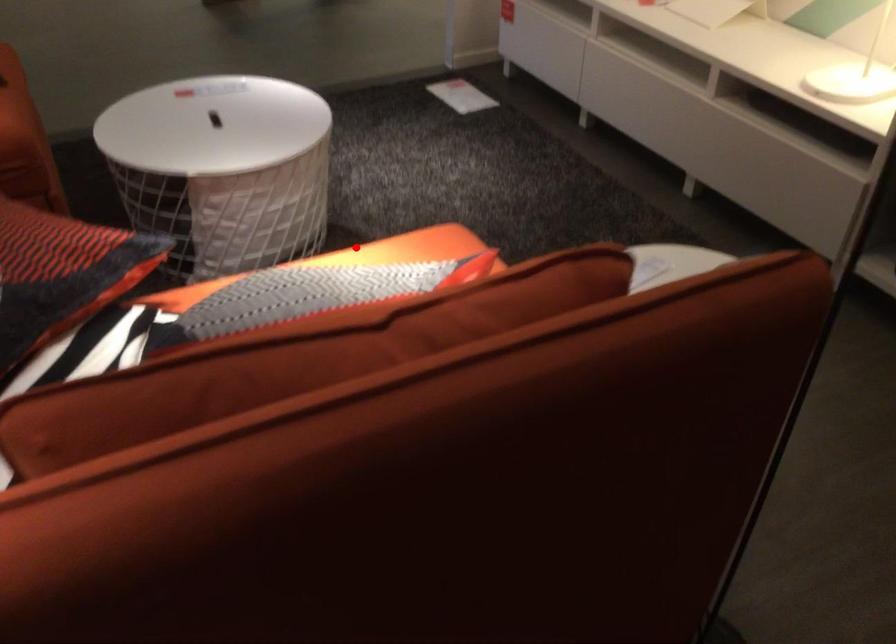
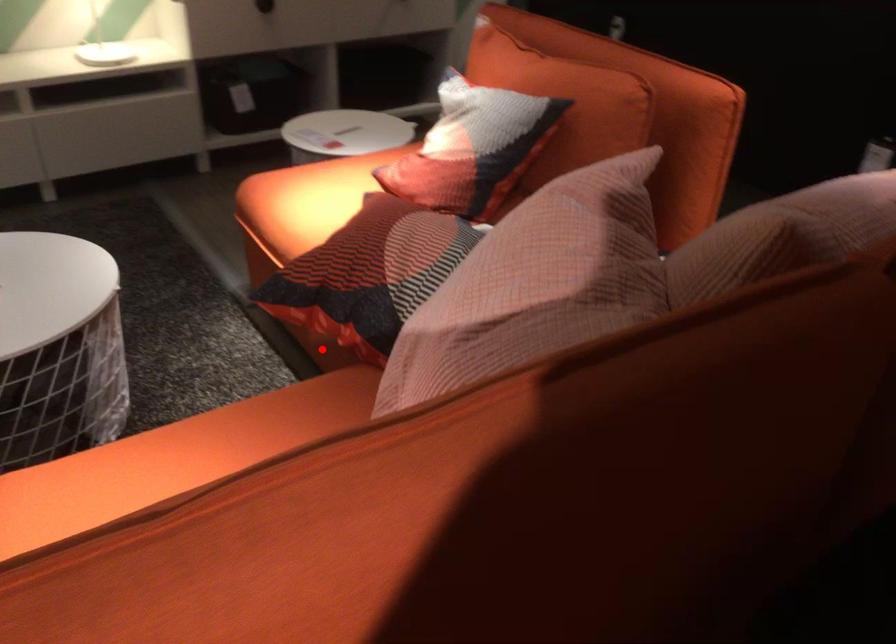
I am providing you with two images of the same scene from different viewpoints. A red point is marked on the first image and another point is marked on the second image. Is the red point in image1 aligned with the point shown in image2?

No